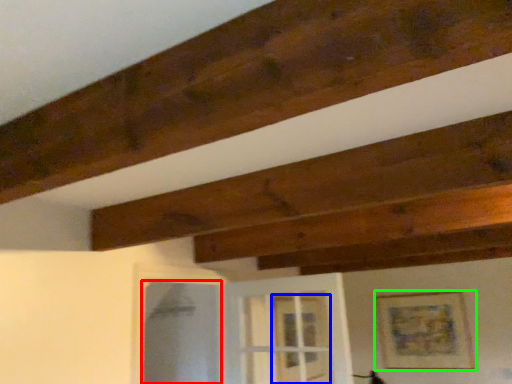
Question: Which is farther away from screen door (highlighted by a red box)? glass door (highlighted by a blue box) or picture frame (highlighted by a green box)?

Choices:
 (A) glass door
 (B) picture frame

Answer: (B)